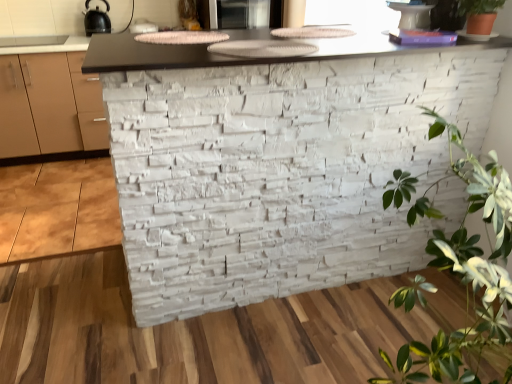
Find the location of a particular element. vacant area to the left of white stone wall at center is located at coordinates (65, 273).